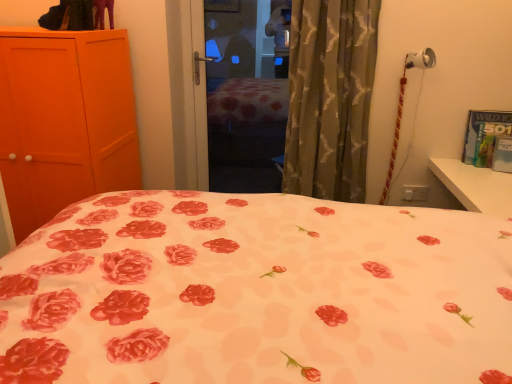
What are the coordinates of `green textured curtain at right` in the screenshot? It's located at (330, 97).

This screenshot has height=384, width=512. What do you see at coordinates (330, 97) in the screenshot?
I see `green textured curtain at right` at bounding box center [330, 97].

At what (x,y) coordinates should I click in order to perform the action: click on matte red and white striped table lamp at upper right. Please return your answer as a coordinate pair (x, y). This screenshot has width=512, height=384. Looking at the image, I should click on (402, 108).

Describe the element at coordinates (402, 108) in the screenshot. Image resolution: width=512 pixels, height=384 pixels. I see `matte red and white striped table lamp at upper right` at that location.

The height and width of the screenshot is (384, 512). I want to click on green textured curtain at right, so click(x=330, y=97).

Is matte red and white striped table lamp at upper right at the left side of green textured curtain at right?

Incorrect, matte red and white striped table lamp at upper right is not on the left side of green textured curtain at right.

In the image, is matte red and white striped table lamp at upper right positioned in front of or behind green textured curtain at right?

Visually, matte red and white striped table lamp at upper right is located behind green textured curtain at right.

Does point (425, 56) lie behind point (347, 35)?

Yes, it is behind point (347, 35).

From the image's perspective, between matte red and white striped table lamp at upper right and green textured curtain at right, which one is located above?

green textured curtain at right, from the image's perspective.

From a real-world perspective, is matte red and white striped table lamp at upper right positioned over green textured curtain at right based on gravity?

No, from a real-world perspective, matte red and white striped table lamp at upper right is not over green textured curtain at right

Does matte red and white striped table lamp at upper right have a lesser width compared to green textured curtain at right?

Yes, matte red and white striped table lamp at upper right is thinner than green textured curtain at right.

Considering the relative sizes of matte red and white striped table lamp at upper right and green textured curtain at right in the image provided, is matte red and white striped table lamp at upper right taller than green textured curtain at right?

No.

Considering the sizes of matte red and white striped table lamp at upper right and green textured curtain at right in the image, is matte red and white striped table lamp at upper right bigger or smaller than green textured curtain at right?

In the image, matte red and white striped table lamp at upper right appears to be smaller than green textured curtain at right.

Consider the image. Is matte red and white striped table lamp at upper right inside or outside of green textured curtain at right?

matte red and white striped table lamp at upper right is spatially situated outside green textured curtain at right.

Is matte red and white striped table lamp at upper right touching green textured curtain at right?

No, matte red and white striped table lamp at upper right is not beside green textured curtain at right.

Is matte red and white striped table lamp at upper right facing away from green textured curtain at right?

No, matte red and white striped table lamp at upper right's orientation is not away from green textured curtain at right.

You are a GUI agent. You are given a task and a screenshot of the screen. Output one action in this format:
    pyautogui.click(x=<x>, y=<y>)
    Task: Click on the table lamp below the green textured curtain at right (from a real-world perspective)
    
    Given the screenshot: What is the action you would take?
    pyautogui.click(x=402, y=108)

Is green textured curtain at right to the left of matte red and white striped table lamp at upper right from the viewer's perspective?

Yes, green textured curtain at right is to the left of matte red and white striped table lamp at upper right.

Looking at this image, which object is more forward, green textured curtain at right or matte red and white striped table lamp at upper right?

green textured curtain at right.

Between point (352, 75) and point (411, 63), which one is positioned in front?

The point (352, 75) is more forward.

From the image's perspective, would you say green textured curtain at right is shown under matte red and white striped table lamp at upper right?

No, from the image's perspective, green textured curtain at right is not beneath matte red and white striped table lamp at upper right.

From a real-world perspective, who is located lower, green textured curtain at right or matte red and white striped table lamp at upper right?

In real-world perspective, matte red and white striped table lamp at upper right is lower.

Does green textured curtain at right have a greater width compared to matte red and white striped table lamp at upper right?

Correct, the width of green textured curtain at right exceeds that of matte red and white striped table lamp at upper right.

Does green textured curtain at right have a greater height compared to matte red and white striped table lamp at upper right?

Indeed, green textured curtain at right has a greater height compared to matte red and white striped table lamp at upper right.

Does green textured curtain at right have a smaller size compared to matte red and white striped table lamp at upper right?

No, green textured curtain at right is not smaller than matte red and white striped table lamp at upper right.

Is green textured curtain at right positioned beyond the bounds of matte red and white striped table lamp at upper right?

Yes, green textured curtain at right is located beyond the bounds of matte red and white striped table lamp at upper right.

Is green textured curtain at right next to matte red and white striped table lamp at upper right and touching it?

No.

Is matte red and white striped table lamp at upper right at the back of green textured curtain at right?

No.

What's the angular difference between green textured curtain at right and matte red and white striped table lamp at upper right's facing directions?

The angular difference between green textured curtain at right and matte red and white striped table lamp at upper right is 0.00269 degrees.

Where is `table lamp behind the green textured curtain at right`? table lamp behind the green textured curtain at right is located at coordinates (402, 108).

I want to click on curtain in front of the matte red and white striped table lamp at upper right, so click(330, 97).

Where is `curtain on the left of matte red and white striped table lamp at upper right`? curtain on the left of matte red and white striped table lamp at upper right is located at coordinates (330, 97).